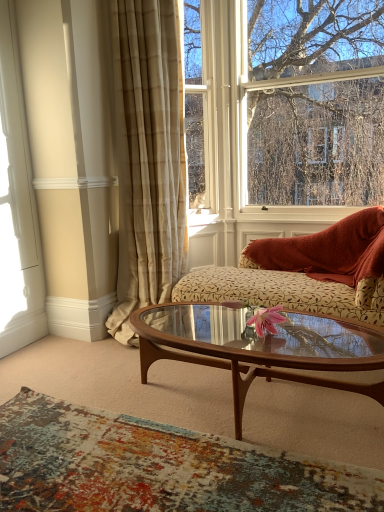
Identify the location of textured rug at lower center. The width and height of the screenshot is (384, 512). (157, 467).

Image resolution: width=384 pixels, height=512 pixels. What do you see at coordinates (315, 102) in the screenshot? I see `clear glass window at upper center` at bounding box center [315, 102].

The height and width of the screenshot is (512, 384). Describe the element at coordinates (148, 158) in the screenshot. I see `beige plaid curtain at center` at that location.

This screenshot has width=384, height=512. What are the coordinates of `wooden glass coffee table at center` in the screenshot? It's located at (261, 348).

Does textured rug at lower center contain clear glass window at upper center?

Actually, clear glass window at upper center is outside textured rug at lower center.

Does textured rug at lower center have a larger size compared to clear glass window at upper center?

No, textured rug at lower center is not bigger than clear glass window at upper center.

Is textured rug at lower center in contact with clear glass window at upper center?

They are not placed beside each other.

From the image's perspective, which is above, textured rug at lower center or clear glass window at upper center?

clear glass window at upper center is shown above in the image.

From a real-world perspective, between wooden glass coffee table at center and floral-patterned fabric couch at center, who is vertically higher?

In real-world perspective, floral-patterned fabric couch at center is above.

Measure the distance between wooden glass coffee table at center and floral-patterned fabric couch at center.

44.99 centimeters.

The image size is (384, 512). What are the coordinates of `coffee table that is in front of the floral-patterned fabric couch at center` in the screenshot? It's located at (261, 348).

Is wooden glass coffee table at center at the left side of floral-patterned fabric couch at center?

Yes, wooden glass coffee table at center is to the left of floral-patterned fabric couch at center.

Considering the relative sizes of white wood window frame at left and floral-patterned fabric couch at center in the image provided, is white wood window frame at left thinner than floral-patterned fabric couch at center?

Yes, white wood window frame at left is thinner than floral-patterned fabric couch at center.

From the image's perspective, is white wood window frame at left positioned above or below floral-patterned fabric couch at center?

white wood window frame at left is situated higher than floral-patterned fabric couch at center in the image.

Is white wood window frame at left not close to floral-patterned fabric couch at center?

Yes.

From a real-world perspective, is white wood window frame at left beneath floral-patterned fabric couch at center?

Incorrect, from a real-world perspective, white wood window frame at left is higher than floral-patterned fabric couch at center.

Would you consider textured rug at lower center to be distant from wooden glass coffee table at center?

No, textured rug at lower center is in close proximity to wooden glass coffee table at center.

From the image's perspective, which is above, textured rug at lower center or wooden glass coffee table at center?

wooden glass coffee table at center, from the image's perspective.

Does textured rug at lower center have a lesser width compared to wooden glass coffee table at center?

No.

Is point (240, 486) in front of point (203, 317)?

Yes.

Which object is positioned more to the right, floral-patterned fabric couch at center or textured rug at lower center?

floral-patterned fabric couch at center is more to the right.

Is floral-patterned fabric couch at center not close to textured rug at lower center?

Yes.

Considering the positions of objects floral-patterned fabric couch at center and textured rug at lower center in the image provided, who is behind, floral-patterned fabric couch at center or textured rug at lower center?

floral-patterned fabric couch at center.

Based on the photo, looking at their sizes, would you say floral-patterned fabric couch at center is wider or thinner than textured rug at lower center?

Considering their sizes, floral-patterned fabric couch at center looks slimmer than textured rug at lower center.

From a real-world perspective, is floral-patterned fabric couch at center on clear glass window at upper center?

Incorrect, from a real-world perspective, floral-patterned fabric couch at center is lower than clear glass window at upper center.

Which is in front, floral-patterned fabric couch at center or clear glass window at upper center?

floral-patterned fabric couch at center.

Looking at this image, how different are the orientations of floral-patterned fabric couch at center and clear glass window at upper center in degrees?

There is a 0.761-degree angle between the facing directions of floral-patterned fabric couch at center and clear glass window at upper center.

Considering the relative positions of floral-patterned fabric couch at center and clear glass window at upper center in the image provided, is floral-patterned fabric couch at center to the left of clear glass window at upper center from the viewer's perspective?

Indeed, floral-patterned fabric couch at center is positioned on the left side of clear glass window at upper center.

Image resolution: width=384 pixels, height=512 pixels. I want to click on window frame above the floral-patterned fabric couch at center (from the image's perspective), so click(x=17, y=206).

Does floral-patterned fabric couch at center touch white wood window frame at left?

No, floral-patterned fabric couch at center is not beside white wood window frame at left.

From the picture: Which of these two, floral-patterned fabric couch at center or white wood window frame at left, stands taller?

Standing taller between the two is white wood window frame at left.

The image size is (384, 512). I want to click on window located behind the textured rug at lower center, so click(x=315, y=102).

At what (x,y) coordinates should I click in order to perform the action: click on coffee table that is in front of the floral-patterned fabric couch at center. Please return your answer as a coordinate pair (x, y). This screenshot has height=512, width=384. Looking at the image, I should click on (261, 348).

When comparing their distances from floral-patterned fabric couch at center, does beige plaid curtain at center or textured rug at lower center seem further?

Among the two, textured rug at lower center is located further to floral-patterned fabric couch at center.

Looking at the image, which one is located further to textured rug at lower center, wooden glass coffee table at center or floral-patterned fabric couch at center?

floral-patterned fabric couch at center lies further to textured rug at lower center than the other object.

In the scene shown: When comparing their distances from textured rug at lower center, does floral-patterned fabric couch at center or wooden glass coffee table at center seem closer?

wooden glass coffee table at center is positioned closer to the anchor textured rug at lower center.

When comparing their distances from clear glass window at upper center, does white wood window frame at left or wooden glass coffee table at center seem further?

white wood window frame at left is further to clear glass window at upper center.

From the image, which object appears to be nearer to clear glass window at upper center, wooden glass coffee table at center or beige plaid curtain at center?

Based on the image, beige plaid curtain at center appears to be nearer to clear glass window at upper center.

Looking at the image, which one is located closer to textured rug at lower center, floral-patterned fabric couch at center or beige plaid curtain at center?

floral-patterned fabric couch at center is positioned closer to the anchor textured rug at lower center.

Looking at the image, which one is located closer to clear glass window at upper center, textured rug at lower center or beige plaid curtain at center?

beige plaid curtain at center is positioned closer to the anchor clear glass window at upper center.

Estimate the real-world distances between objects in this image. Which object is further from textured rug at lower center, floral-patterned fabric couch at center or clear glass window at upper center?

clear glass window at upper center is positioned further to the anchor textured rug at lower center.

Locate an element on the screen. The width and height of the screenshot is (384, 512). curtain between white wood window frame at left and wooden glass coffee table at center in the horizontal direction is located at coordinates (148, 158).

The width and height of the screenshot is (384, 512). Identify the location of coffee table between beige plaid curtain at center and textured rug at lower center vertically. (261, 348).

At what (x,y) coordinates should I click in order to perform the action: click on curtain between clear glass window at upper center and textured rug at lower center in the vertical direction. Please return your answer as a coordinate pair (x, y). This screenshot has height=512, width=384. Looking at the image, I should click on (148, 158).

Locate an element on the screen. plain between white wood window frame at left and floral-patterned fabric couch at center from left to right is located at coordinates (157, 467).